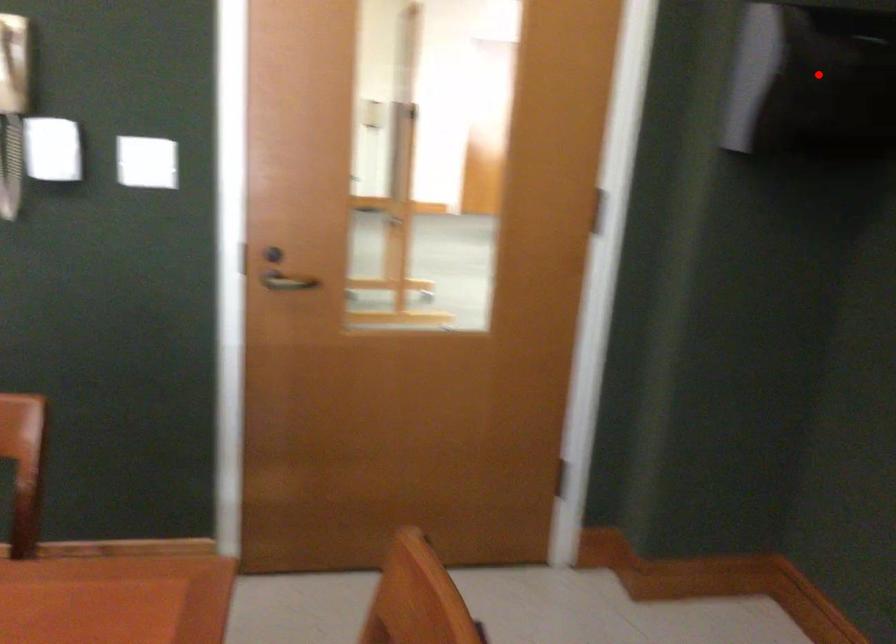
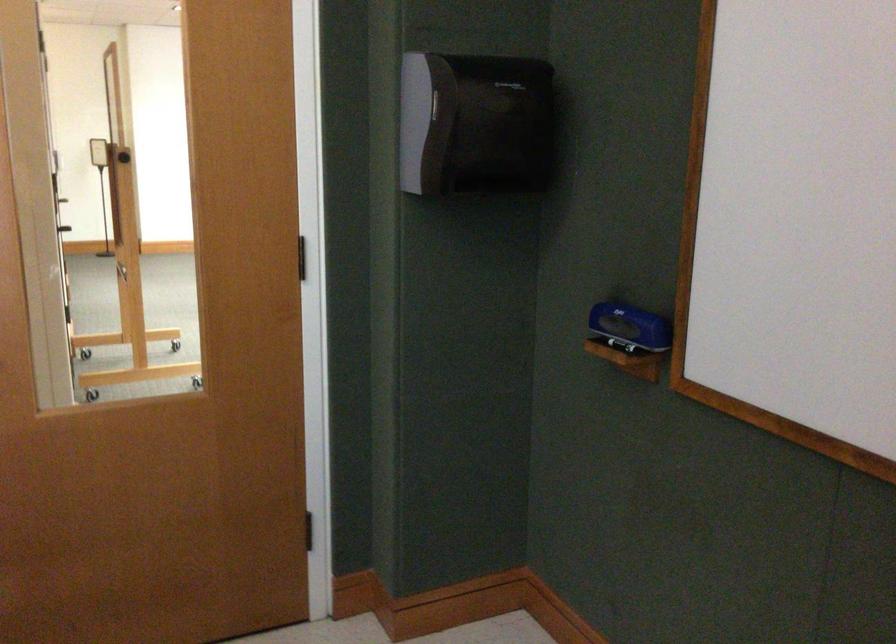
Locate, in the second image, the point that corresponds to the highlighted location in the first image.

(474, 122)